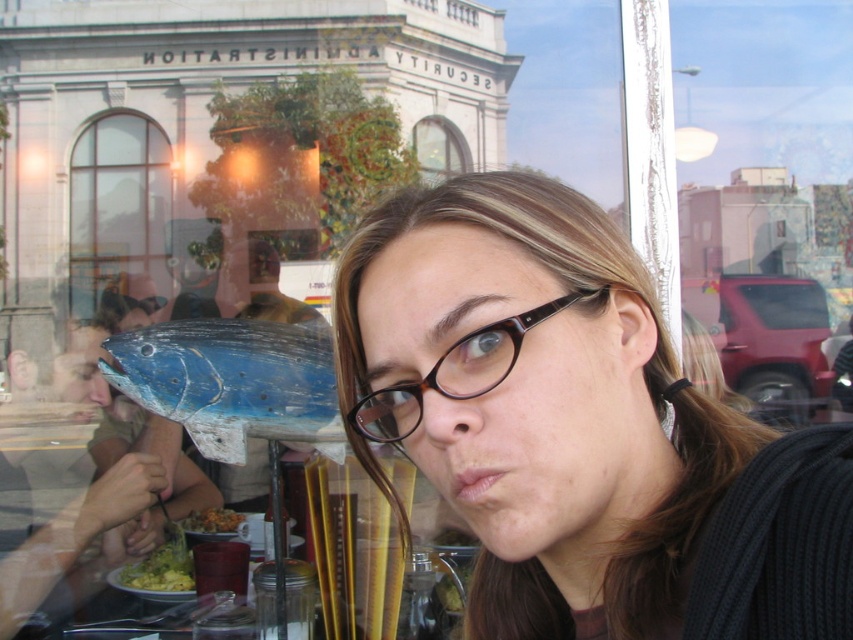
Does matte black glasses at center have a greater width compared to clear glass window at upper left?

Yes.

Is the position of matte black glasses at center more distant than that of clear glass window at upper left?

No, it is in front of clear glass window at upper left.

Who is more forward, (396, 435) or (141, 269)?

Point (396, 435) is more forward.

This screenshot has height=640, width=853. Identify the location of matte black glasses at center. (577, 428).

This screenshot has height=640, width=853. What do you see at coordinates (577, 428) in the screenshot?
I see `matte black glasses at center` at bounding box center [577, 428].

Can you confirm if matte black glasses at center is bigger than clear glass window at upper center?

Yes, matte black glasses at center is bigger than clear glass window at upper center.

Describe the element at coordinates (577, 428) in the screenshot. I see `matte black glasses at center` at that location.

Where is `matte black glasses at center`? This screenshot has width=853, height=640. matte black glasses at center is located at coordinates (577, 428).

From the picture: Is matte black glasses at center thinner than blue wooden fish at center?

No.

Can you confirm if matte black glasses at center is positioned below blue wooden fish at center?

Correct, matte black glasses at center is located below blue wooden fish at center.

This screenshot has width=853, height=640. What are the coordinates of `matte black glasses at center` in the screenshot? It's located at (577, 428).